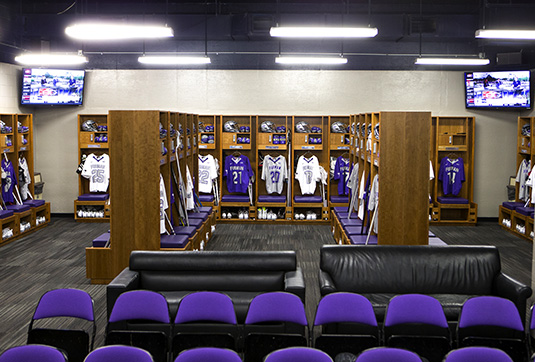
At what (x,y) coordinates should I click in order to perform the action: click on wooden shelves. Please return your answer as a coordinate pair (x, y). The height and width of the screenshot is (362, 535). Looking at the image, I should click on (454, 144), (340, 145), (305, 145), (262, 148), (221, 149), (201, 149), (91, 143), (17, 144), (9, 148).